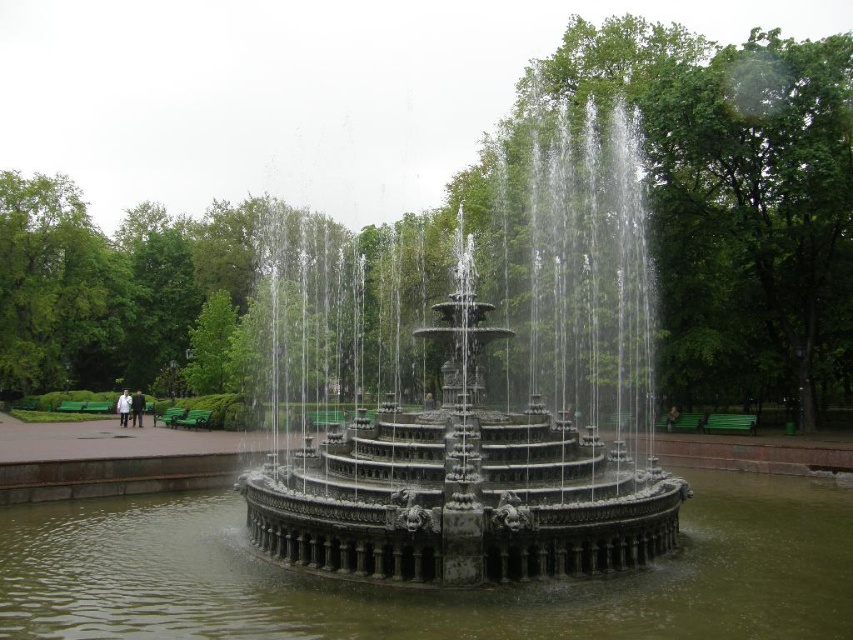
You are standing at the center of the park and want to locate the polished stone fountain at center. Which direction should you look to find it?

The polished stone fountain at center is located at point coordinates of (503, 417), so you should look towards the center of the park to find it.